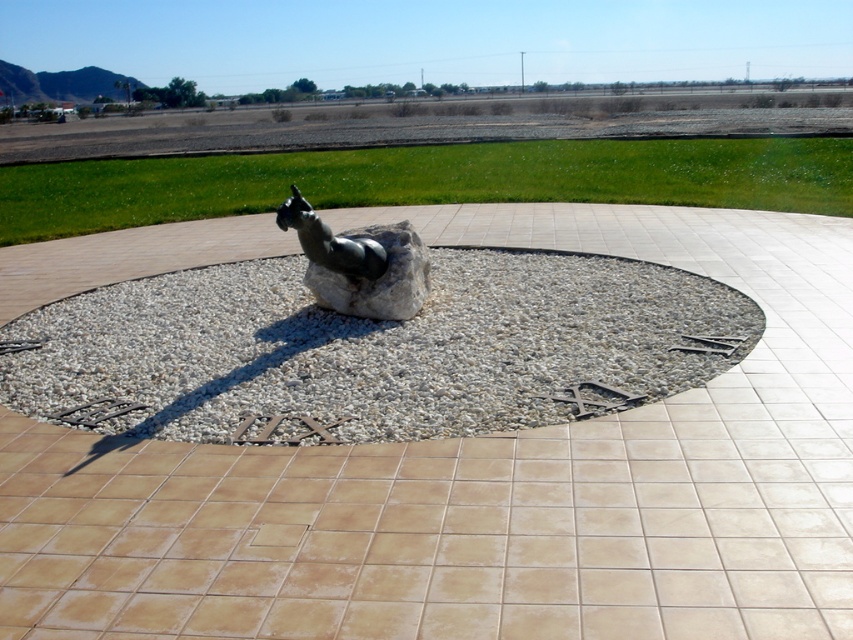
Who is taller, sandy beige stone at center or white gravel at center?

white gravel at center is taller.

Who is more distant from viewer, (672, 506) or (77, 349)?

The point (77, 349) is more distant.

Locate an element on the screen. Image resolution: width=853 pixels, height=640 pixels. sandy beige stone at center is located at coordinates (485, 484).

Which is behind, point (466, 577) or point (422, 273)?

The point (422, 273) is behind.

Does sandy beige stone at center have a greater height compared to bronze statue at center?

No, sandy beige stone at center is not taller than bronze statue at center.

Does point (749, 356) come farther from viewer compared to point (419, 301)?

No, (749, 356) is in front of (419, 301).

Where is `sandy beige stone at center`? sandy beige stone at center is located at coordinates (485, 484).

Between white gravel at center and polished bronze horse at center, which one is positioned lower?

white gravel at center

Can you confirm if white gravel at center is smaller than polished bronze horse at center?

Incorrect, white gravel at center is not smaller in size than polished bronze horse at center.

At what (x,y) coordinates should I click in order to perform the action: click on white gravel at center. Please return your answer as a coordinate pair (x, y). The width and height of the screenshot is (853, 640). Looking at the image, I should click on [373, 349].